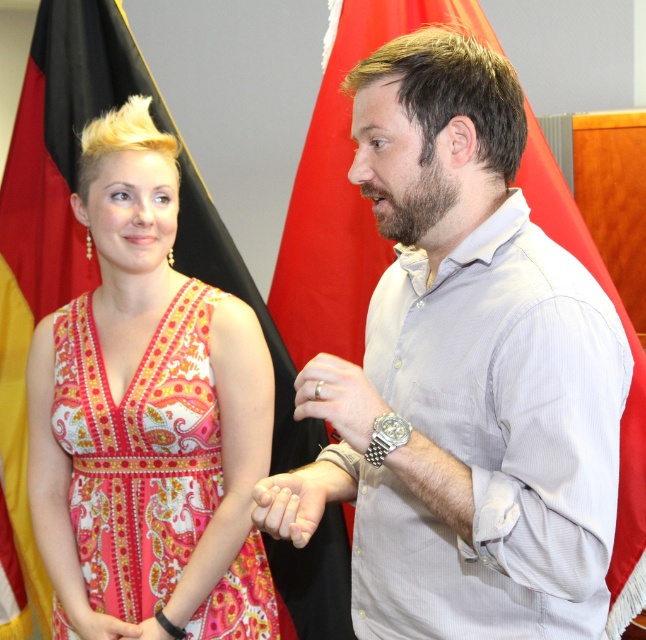
Is silver metallic ring at center below pink fabric dress at lower left?

Incorrect, silver metallic ring at center is not positioned below pink fabric dress at lower left.

Who is more distant from viewer, (362, 449) or (63, 611)?

Positioned behind is point (63, 611).

Image resolution: width=646 pixels, height=640 pixels. I want to click on silver metallic ring at center, so click(x=339, y=397).

Is point (304, 496) in front of point (85, 620)?

Yes, point (304, 496) is in front of point (85, 620).

Between smooth skin hand at center and pink fabric dress at lower left, which one has less height?

pink fabric dress at lower left is shorter.

Is point (326, 490) positioned behind point (132, 628)?

That is False.

Where is `smooth skin hand at center`? This screenshot has height=640, width=646. smooth skin hand at center is located at coordinates [298, 499].

Does point (534, 308) come in front of point (81, 634)?

Yes, it is.

Which is behind, point (570, 449) or point (103, 637)?

The point (103, 637) is behind.

Locate an element on the screen. The height and width of the screenshot is (640, 646). gray fabric shirt at center is located at coordinates (475, 369).